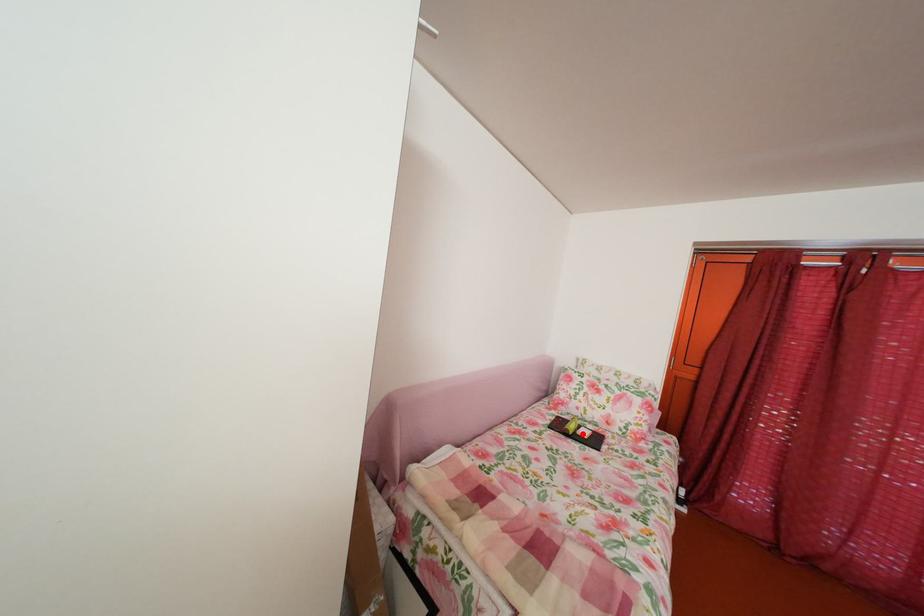
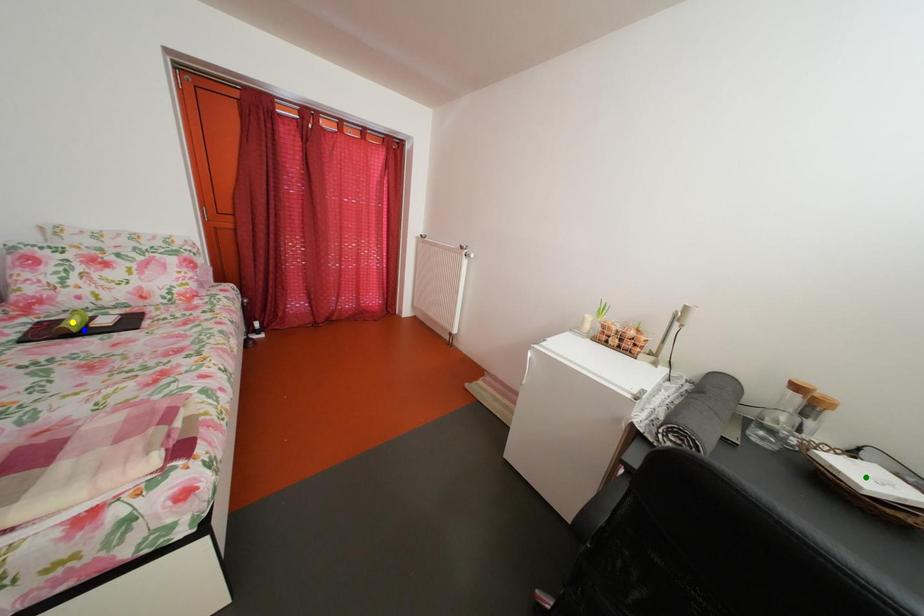
Question: I am providing you with two images of the same scene from different viewpoints. A red point is marked on the first image. You are given multiple points on the second image. Which point in image 2 represents the same 3d spot as the red point in image 1?

Choices:
 (A) green point
 (B) yellow point
 (C) blue point

Answer: (C)